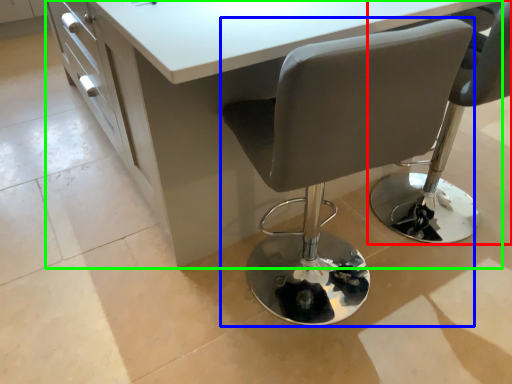
Question: Considering the real-world distances, which object is closest to chair (highlighted by a red box)? chair (highlighted by a blue box) or table (highlighted by a green box).

Choices:
 (A) chair
 (B) table

Answer: (B)